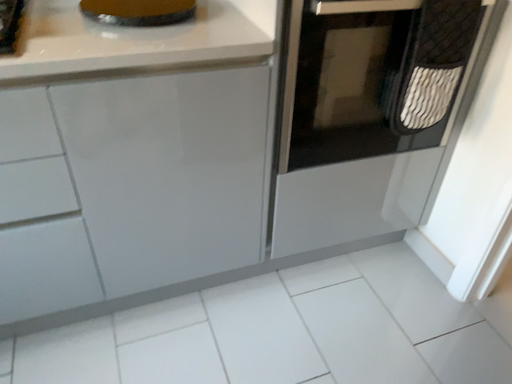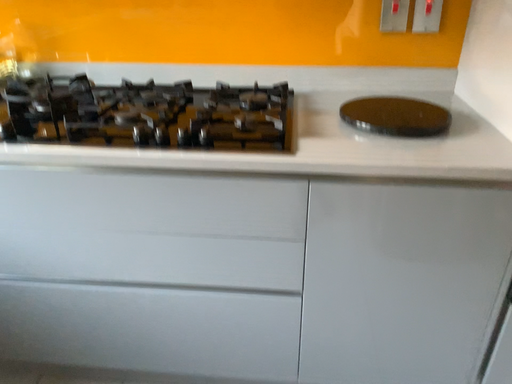
Question: Which way did the camera rotate in the video?

Choices:
 (A) rotated left
 (B) rotated right

Answer: (A)